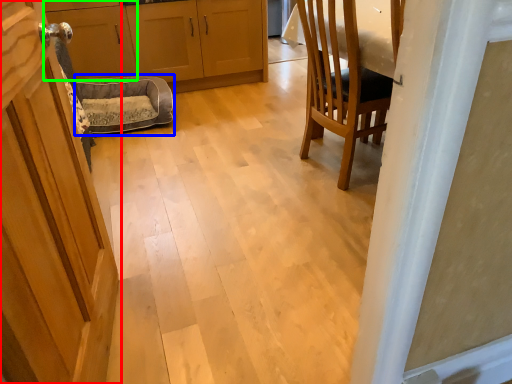
Question: Which object is positioned closest to door (highlighted by a red box)? Select from dog bed (highlighted by a blue box) and cabinetry (highlighted by a green box).

Choices:
 (A) dog bed
 (B) cabinetry

Answer: (A)